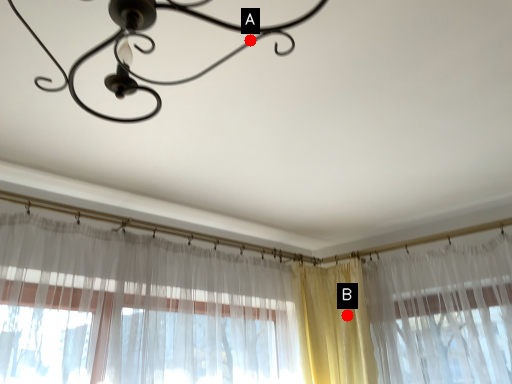
Question: Two points are circled on the image, labeled by A and B beside each circle. Which point is further to the camera?

Choices:
 (A) A is further
 (B) B is further

Answer: (B)